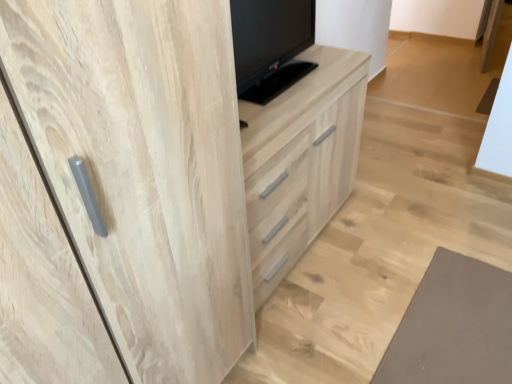
Find the location of a particular element. Image resolution: width=512 pixels, height=384 pixels. vacant space in front of light wood cabinet at center is located at coordinates (345, 323).